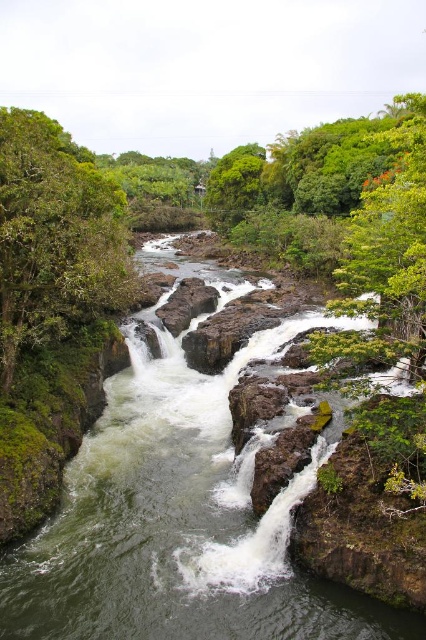
You are a hiker planning to cross the river at the location shown in the image. You see the white frothy water at center and the rough brown rock at center. Which object is located below the other?

The white frothy water at center is positioned under the rough brown rock at center, so the white frothy water is below the rough brown rock.

You are a hiker standing at the edge of the river. You see the white frothy water at center and the green leafy tree at left. Which object is nearer to you?

The white frothy water at center is closer to the viewer than the green leafy tree at left, so it is nearer to you.